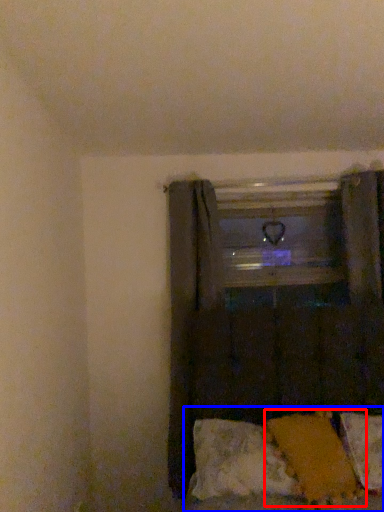
Question: Which object appears closest to the camera in this image, pillow (highlighted by a red box) or bed (highlighted by a blue box)?

Choices:
 (A) pillow
 (B) bed

Answer: (A)